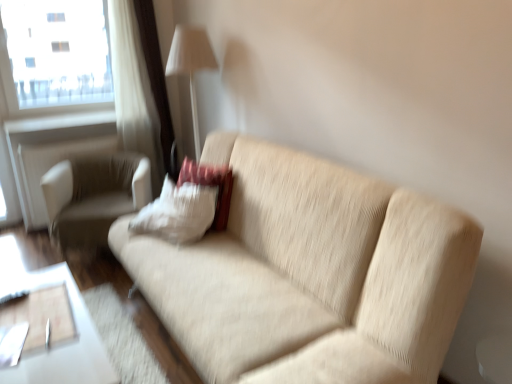
Question: In the image, is white fabric window frame at upper left on the left side or the right side of beige fabric couch at center?

Choices:
 (A) left
 (B) right

Answer: (A)

Question: From the image's perspective, is white fabric window frame at upper left above or below beige fabric couch at center?

Choices:
 (A) above
 (B) below

Answer: (A)

Question: Which object is positioned farthest from the white fabric chair at left?

Choices:
 (A) beige fabric couch at center
 (B) white fabric window frame at upper left
 (C) white matte radiator at upper left
 (D) white fabric lampshade at upper center
 (E) white soft pillow at center

Answer: (A)

Question: Based on their relative distances, which object is farther from the white fabric chair at left?

Choices:
 (A) white soft pillow at center
 (B) transparent glass window at upper left
 (C) white fabric window frame at upper left
 (D) white fabric lampshade at upper center
 (E) beige fabric couch at center

Answer: (B)